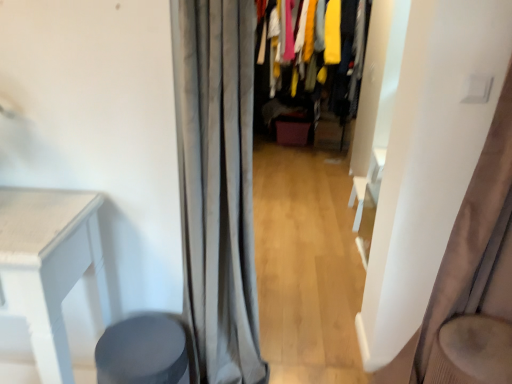
Locate an element on the screen. This screenshot has width=512, height=384. free space above matte gray stool at lower left (from a real-world perspective) is located at coordinates (145, 339).